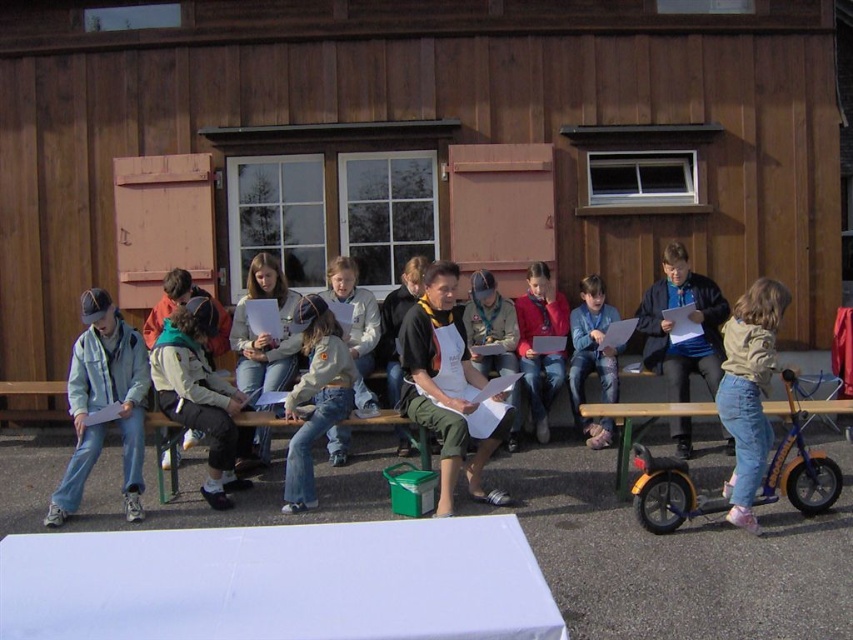
Is green fleece jacket at center positioned at the back of orange plastic picnic table at lower right?

Yes, it is.

Which is below, green fleece jacket at center or orange plastic picnic table at lower right?

orange plastic picnic table at lower right is below.

Who is more forward, (189, 426) or (706, 403)?

Point (189, 426)

In order to click on green fleece jacket at center in this screenshot , I will do `click(198, 394)`.

Does denim jacket at left have a smaller size compared to blue denim jacket at center?

Correct, denim jacket at left occupies less space than blue denim jacket at center.

Which is in front, point (138, 344) or point (637, 308)?

Positioned in front is point (138, 344).

Is point (85, 323) positioned before point (657, 324)?

That is True.

This screenshot has height=640, width=853. Find the location of `denim jacket at left`. denim jacket at left is located at coordinates (103, 403).

Who is lower down, wooden bench at center or light brown denim jeans at lower right?

light brown denim jeans at lower right is lower down.

Which is more to the right, wooden bench at center or light brown denim jeans at lower right?

light brown denim jeans at lower right

Which is behind, point (390, 10) or point (735, 433)?

The point (390, 10) is behind.

Where is `wooden bench at center`? Image resolution: width=853 pixels, height=640 pixels. wooden bench at center is located at coordinates (431, 141).